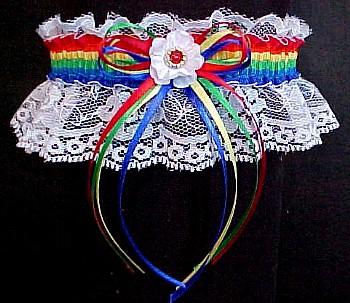
The width and height of the screenshot is (350, 303). Identify the location of rainbow colored trim. (271, 59).